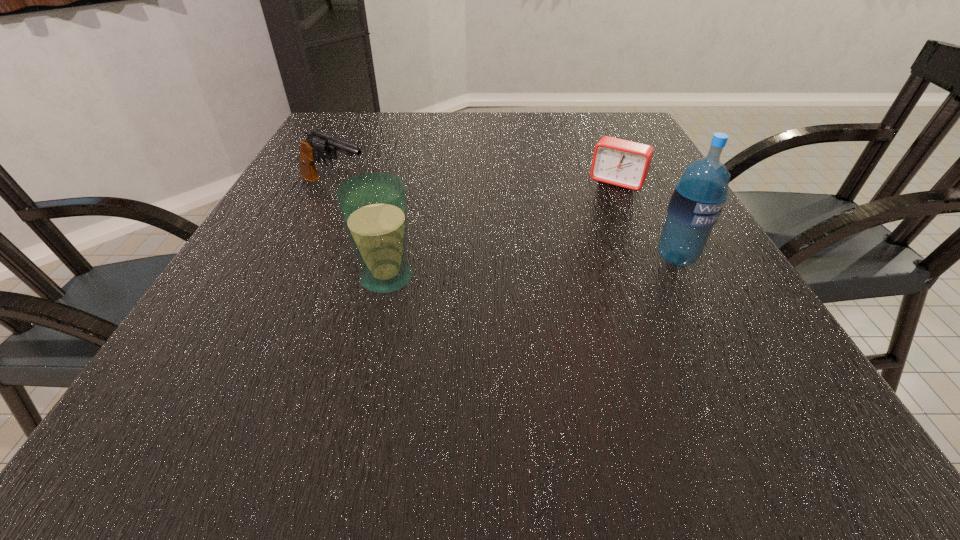
The height and width of the screenshot is (540, 960). In the image, there is a desktop. Identify the location of vacant space at the far left corner. (348, 114).

Locate an element on the screen. This screenshot has height=540, width=960. vacant space at the far right corner of the desktop is located at coordinates (595, 131).

You are a GUI agent. You are given a task and a screenshot of the screen. Output one action in this format:
    pyautogui.click(x=<x>, y=<y>)
    Task: Click on the vacant space that is in between the shortest object and the glass
    Image resolution: width=960 pixels, height=540 pixels.
    Given the screenshot: What is the action you would take?
    pyautogui.click(x=502, y=230)

Where is `empty space between the tallest object and the alarm clock`? The width and height of the screenshot is (960, 540). empty space between the tallest object and the alarm clock is located at coordinates (646, 220).

Find the location of a particular element. The width and height of the screenshot is (960, 540). unoccupied position between the leftmost object and the alarm clock is located at coordinates (476, 185).

Identify the location of free space between the shortest object and the water bottle. (646, 220).

The width and height of the screenshot is (960, 540). Identify the location of free space between the shortest object and the gun. pyautogui.click(x=476, y=185).

Where is `empty space that is in between the tallest object and the leftmost object`? This screenshot has height=540, width=960. empty space that is in between the tallest object and the leftmost object is located at coordinates point(505,222).

Find the location of `vacant space that is in between the alarm clock and the tallest object`. vacant space that is in between the alarm clock and the tallest object is located at coordinates (646, 220).

Where is `free point between the shortest object and the tallest object`? The image size is (960, 540). free point between the shortest object and the tallest object is located at coordinates (646, 220).